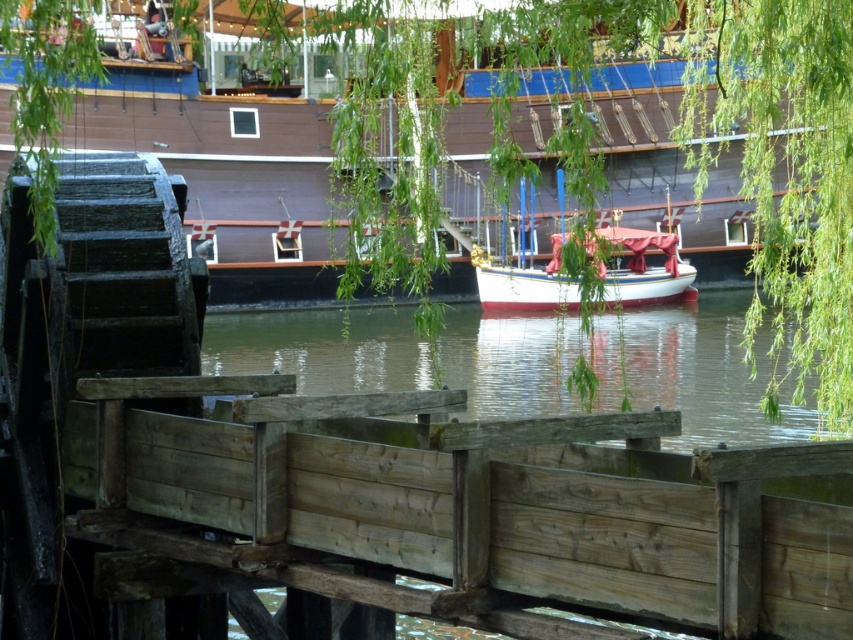
You are standing at the riverside and want to determine which of the two points, point (807,561) or point (569,186), is closer to you. Based on the scene, which point is nearer?

Point (807,561) is closer to the viewer than point (569,186).